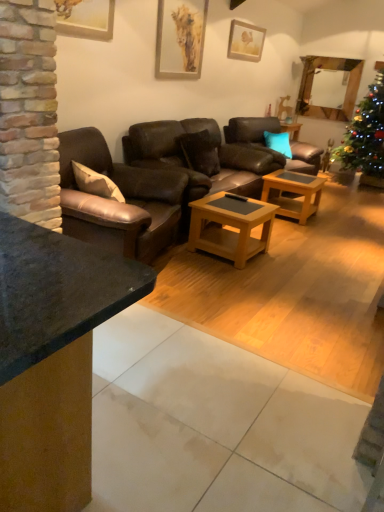
I want to click on matte gold picture frame at upper center, arranged as the 2th picture frame when viewed from the left, so click(x=180, y=38).

How much space does matte gold picture frame at upper center, the second picture frame when ordered from back to front, occupy vertically?

matte gold picture frame at upper center, the second picture frame when ordered from back to front, is 34.38 inches tall.

Based on the photo, measure the distance between point (x=64, y=142) and camera.

Point (x=64, y=142) is 10.26 feet from camera.

Image resolution: width=384 pixels, height=512 pixels. I want to click on matte wooden picture frame at upper center, the 1th picture frame viewed from the right, so click(x=245, y=41).

Consider the image. How much space does teal fabric pillow at center, placed as the second pillow when sorted from front to back, occupy vertically?

Result: It is 17.81 inches.

Find the location of a particular element. brown leather armchair at center is located at coordinates (268, 147).

Is matte wooden picture frame at upper center, the 1th picture frame viewed from the right, taller or shorter than woodenwoodencoffee table at center, the 1th coffee table positioned from the right?

Clearly, matte wooden picture frame at upper center, the 1th picture frame viewed from the right, is shorter compared to woodenwoodencoffee table at center, the 1th coffee table positioned from the right.

From the image's perspective, who appears lower, matte wooden picture frame at upper center, the 1th picture frame viewed from the right, or woodenwoodencoffee table at center, the 1th coffee table positioned from the right?

woodenwoodencoffee table at center, the 1th coffee table positioned from the right.

Is woodenwoodencoffee table at center, which is the second coffee table in left-to-right order, completely or partially inside matte wooden picture frame at upper center, arranged as the 3th picture frame when viewed from the front?

Definitely not — woodenwoodencoffee table at center, which is the second coffee table in left-to-right order, is not inside matte wooden picture frame at upper center, arranged as the 3th picture frame when viewed from the front.

In the scene shown: Is the surface of matte wooden picture frame at upper center, the 1th picture frame viewed from the back, in direct contact with woodenwoodencoffee table at center, positioned as the first coffee table in back-to-front order?

No.

Is teal fabric pillow at center, which is counted as the 2th pillow, starting from the left, touching matte wooden picture frame at upper center, arranged as the 3th picture frame when viewed from the front?

No, teal fabric pillow at center, which is counted as the 2th pillow, starting from the left, is not next to matte wooden picture frame at upper center, arranged as the 3th picture frame when viewed from the front.

Is teal fabric pillow at center, placed as the second pillow when sorted from front to back, turned away from matte wooden picture frame at upper center, arranged as the 3th picture frame when viewed from the front?

That's not correct — teal fabric pillow at center, placed as the second pillow when sorted from front to back, is not looking away from matte wooden picture frame at upper center, arranged as the 3th picture frame when viewed from the front.

Which is further, (274, 147) or (235, 24)?

Point (274, 147)

From a real-world perspective, which object stands above the other?

matte wooden picture frame at upper center, the third picture frame from the left, is physically above.

Considering their positions, is brown leather armchair at center located in front of or behind teal fabric pillow at center, placed as the second pillow when sorted from front to back?

Visually, brown leather armchair at center is located in front of teal fabric pillow at center, placed as the second pillow when sorted from front to back.

Between brown leather armchair at center and teal fabric pillow at center, placed as the second pillow when sorted from front to back, which one has more height?

brown leather armchair at center.

From the image's perspective, which is below, brown leather armchair at center or teal fabric pillow at center, placed as the second pillow when sorted from front to back?

brown leather armchair at center, from the image's perspective.

How many degrees apart are the facing directions of woodenwoodencoffee table at center, which is the second coffee table in left-to-right order, and brown leather couch at center, the second studio couch when ordered from front to back?

They differ by 1.3 degrees in their facing directions.

Which of these two, woodenwoodencoffee table at center, which is the second coffee table in left-to-right order, or brown leather couch at center, which appears as the 1th studio couch when viewed from the back, is wider?

Wider between the two is brown leather couch at center, which appears as the 1th studio couch when viewed from the back.

From a real-world perspective, is woodenwoodencoffee table at center, the 1th coffee table positioned from the right, on top of brown leather couch at center, which appears as the 1th studio couch when viewed from the back?

No.

Image resolution: width=384 pixels, height=512 pixels. I want to click on the 1st coffee table positioned below the brown leather couch at center, the second studio couch when ordered from front to back (from a real-world perspective), so click(x=293, y=193).

Which of these two, teal fabric pillow at center, which is counted as the 2th pillow, starting from the left, or brown leather couch at center, which appears as the 1th studio couch when viewed from the back, is bigger?

Bigger between the two is brown leather couch at center, which appears as the 1th studio couch when viewed from the back.

From a real-world perspective, is teal fabric pillow at center, marked as the 1th pillow in a back-to-front arrangement, under brown leather couch at center, the second studio couch when ordered from front to back?

Actually, teal fabric pillow at center, marked as the 1th pillow in a back-to-front arrangement, is physically above brown leather couch at center, the second studio couch when ordered from front to back, in the real world.

Is teal fabric pillow at center, the 1th pillow when ordered from right to left, in front of or behind brown leather couch at center, the second studio couch when ordered from front to back, in the image?

teal fabric pillow at center, the 1th pillow when ordered from right to left, is behind brown leather couch at center, the second studio couch when ordered from front to back.

Is brown leather couch at center, the second studio couch when ordered from back to front, taller or shorter than brown leather armchair at center?

Clearly, brown leather couch at center, the second studio couch when ordered from back to front, is taller compared to brown leather armchair at center.

Is brown leather couch at center, the first studio couch viewed from the front, aimed at brown leather armchair at center?

No.

In the scene shown: Is brown leather couch at center, the first studio couch viewed from the front, positioned behind brown leather armchair at center?

No, it is not.

From the image's perspective, which one is positioned higher, brown leather couch at center, the second studio couch when ordered from back to front, or brown leather armchair at center?

brown leather armchair at center appears higher in the image.

Which object is wider, brown leather armchair at center or brown leather couch at center, the first studio couch viewed from the front?

Wider between the two is brown leather couch at center, the first studio couch viewed from the front.

Based on the photo, from a real-world perspective, is brown leather armchair at center on top of brown leather couch at center, the first studio couch viewed from the front?

Incorrect, from a real-world perspective, brown leather armchair at center is lower than brown leather couch at center, the first studio couch viewed from the front.

Considering the relative positions of brown leather armchair at center and brown leather couch at center, the second studio couch when ordered from back to front, in the image provided, is brown leather armchair at center to the right of brown leather couch at center, the second studio couch when ordered from back to front, from the viewer's perspective?

Yes.

Would you consider brown leather armchair at center to be distant from brown leather couch at center, the first studio couch viewed from the front?

Yes, brown leather armchair at center and brown leather couch at center, the first studio couch viewed from the front, are located far from each other.

Image resolution: width=384 pixels, height=512 pixels. In order to click on the 1st coffee table in front when counting from the matte wooden picture frame at upper center, arranged as the 3th picture frame when viewed from the front in this screenshot , I will do `click(293, 193)`.

Which picture frame is the 1st one when counting from the left side of the teal fabric pillow at center, the 1th pillow when ordered from right to left? Please provide its 2D coordinates.

[(245, 41)]

Looking at the image, which one is located closer to brown leather pillow at center, arranged as the first pillow when viewed from the front, woodenwoodencoffee table at center, positioned as the first coffee table in back-to-front order, or brown leather armchair at center?

woodenwoodencoffee table at center, positioned as the first coffee table in back-to-front order, is closer to brown leather pillow at center, arranged as the first pillow when viewed from the front.

Estimate the real-world distances between objects in this image. Which object is closer to brown leather pillow at center, arranged as the first pillow when viewed from the front, woodenwoodencoffee table at center, the 1th coffee table positioned from the right, or matte wooden picture frame at upper center, the 1th picture frame viewed from the right?

woodenwoodencoffee table at center, the 1th coffee table positioned from the right, lies closer to brown leather pillow at center, arranged as the first pillow when viewed from the front, than the other object.

Which object lies further to the anchor point matte gold picture frame at upper center, arranged as the 2th picture frame when viewed from the left, woodenwoodencoffee table at center, which is the second coffee table in left-to-right order, or brown leather armchair at center?

brown leather armchair at center is further to matte gold picture frame at upper center, arranged as the 2th picture frame when viewed from the left.

Considering their positions, is brown leather pillow at center, the first pillow in the left-to-right sequence, positioned closer to woodenwoodencoffee table at center, which is the second coffee table in left-to-right order, than teal fabric pillow at center, the 1th pillow when ordered from right to left?

brown leather pillow at center, the first pillow in the left-to-right sequence.

Which object lies nearer to the anchor point woodenwoodencoffee table at center, positioned as the first coffee table in back-to-front order, teal fabric pillow at center, the 1th pillow when ordered from right to left, or matte wooden picture frame at upper center, the 1th picture frame viewed from the right?

Based on the image, teal fabric pillow at center, the 1th pillow when ordered from right to left, appears to be nearer to woodenwoodencoffee table at center, positioned as the first coffee table in back-to-front order.

Considering their positions, is wooden picture frame at upper left, which ranks as the 1th picture frame in left-to-right order, positioned further to matte gold picture frame at upper center, arranged as the 2th picture frame when viewed from the left, than woodenwoodencoffee table at center, positioned as the first coffee table in back-to-front order?

The object further to matte gold picture frame at upper center, arranged as the 2th picture frame when viewed from the left, is woodenwoodencoffee table at center, positioned as the first coffee table in back-to-front order.

Which object lies further to the anchor point woodenwoodencoffee table at center, the second coffee table from the right, wooden picture frame at upper left, which ranks as the 1th picture frame in left-to-right order, or brown leather couch at center, the first studio couch viewed from the front?

Among the two, wooden picture frame at upper left, which ranks as the 1th picture frame in left-to-right order, is located further to woodenwoodencoffee table at center, the second coffee table from the right.

Estimate the real-world distances between objects in this image. Which object is closer to woodenwoodencoffee table at center, positioned as the first coffee table in back-to-front order, matte gold picture frame at upper center, the second picture frame when ordered from back to front, or brown leather pillow at center, the first pillow in the left-to-right sequence?

brown leather pillow at center, the first pillow in the left-to-right sequence.

The width and height of the screenshot is (384, 512). I want to click on pillow between brown leather couch at center, the second studio couch when ordered from back to front, and woodenwoodencoffee table at center, positioned as the first coffee table in back-to-front order, along the z-axis, so click(200, 151).

You are a GUI agent. You are given a task and a screenshot of the screen. Output one action in this format:
    pyautogui.click(x=<x>, y=<y>)
    Task: Click on the studio couch located between woodenwoodencoffee table at center, the second coffee table from the right, and woodenwoodencoffee table at center, which is counted as the 2th coffee table, starting from the front, in the depth direction
    This screenshot has height=512, width=384.
    Given the screenshot: What is the action you would take?
    pyautogui.click(x=213, y=154)

I want to click on studio couch between matte gold picture frame at upper center, which is the 2th picture frame from front to back, and woodenwoodencoffee table at center, which is the second coffee table in left-to-right order, in the vertical direction, so click(213, 154).

The width and height of the screenshot is (384, 512). What are the coordinates of `picture frame located between brown leather couch at center, the second studio couch when ordered from front to back, and brown leather armchair at center in the depth direction` in the screenshot? It's located at (180, 38).